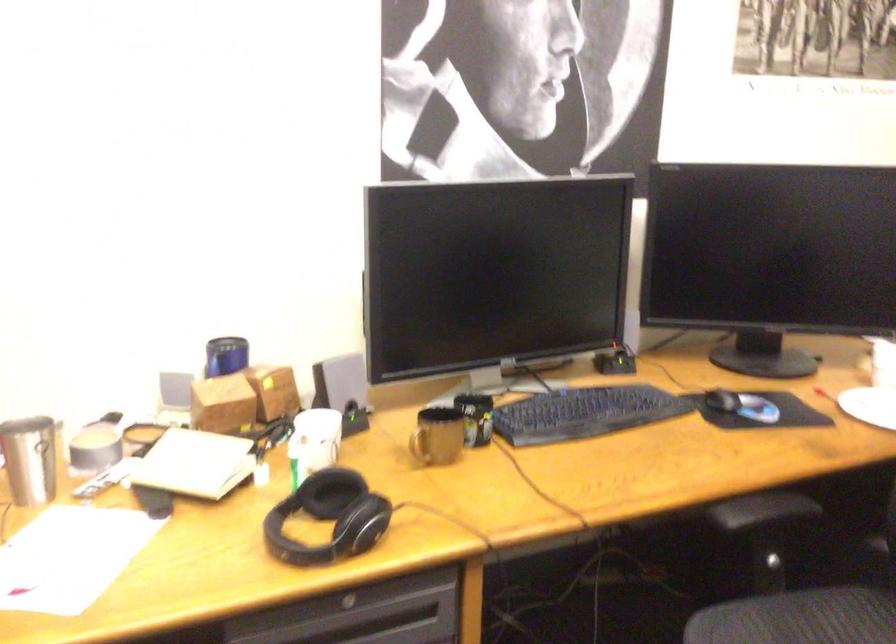
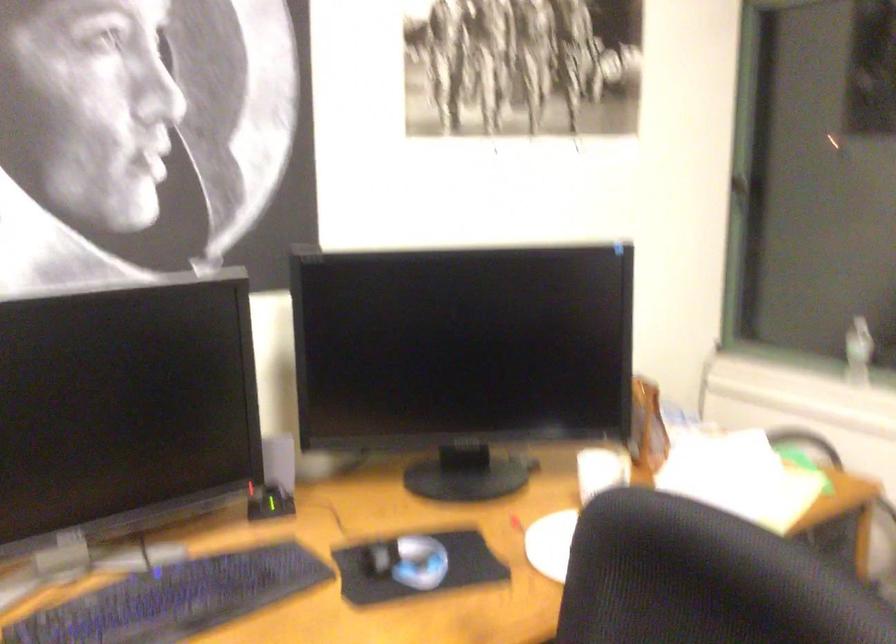
Question: Based on the continuous images, in which direction is the camera rotating? Reply with the corresponding letter.

Choices:
 (A) Left
 (B) Right
 (C) Up
 (D) Down

Answer: (B)